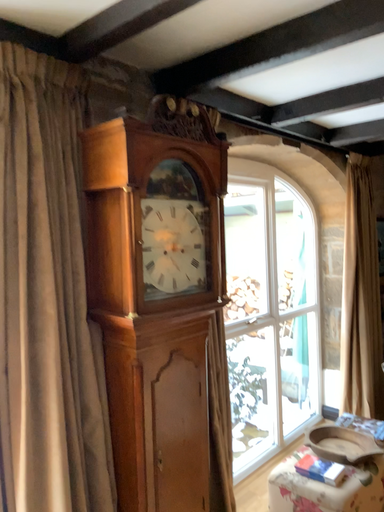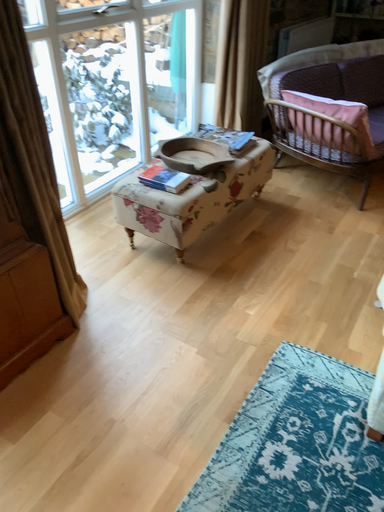
Question: Which way did the camera rotate in the video?

Choices:
 (A) rotated left
 (B) rotated right

Answer: (B)